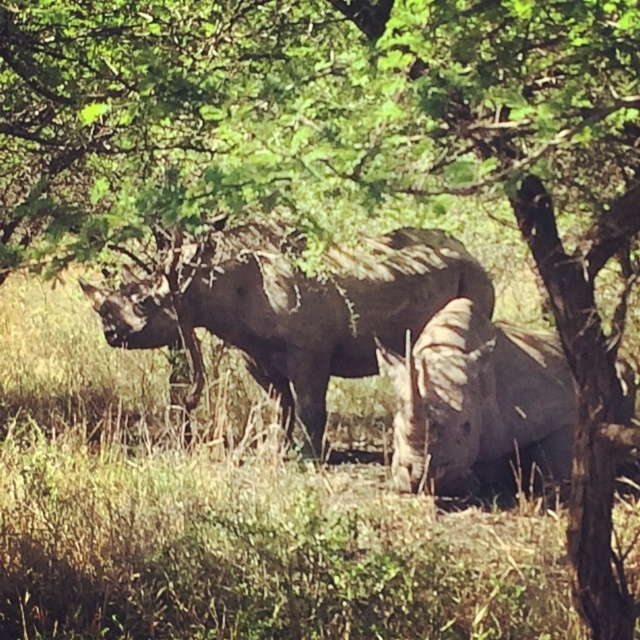
You are a wildlife photographer aiming to capture a closeup shot of the dark gray textured rhino at center and the gray matte rhinoceros at center. Since you want to focus on one rhino at a time, which rhino should you choose to ensure your camera can fully capture its entire body in the frame without cropping?

The gray matte rhinoceros at center should be chosen because it is smaller in size than the dark gray textured rhino at center, making it easier to fit entirely within the camera frame without cropping.

You are standing at the origin point in the image. The dark gray textured rhino at center is located at coordinates 0.478 on the x axis and 0.508 on the y axis. If you want to walk directly towards the rhino, in which direction should you move? Please provide your answer in terms of compass directions like north, south, east, or west.

Since the dark gray textured rhino at center is located at coordinates 0.478 on the x axis and 0.508 on the y axis, you should move west to reach it because the x coordinate is less than 0.5, indicating it is to the left of the center point.

You are a wildlife photographer standing at the edge of the grassy area. You want to take a photo of the dark gray textured rhino at center. If your camera has a maximum focus range of 7 meters, will you be able to capture the rhino clearly?

The dark gray textured rhino at center is 7.13 meters from camera. Since the distance is slightly beyond the camera maximum focus range of 7 meters, you won not be able to capture the rhino clearly.